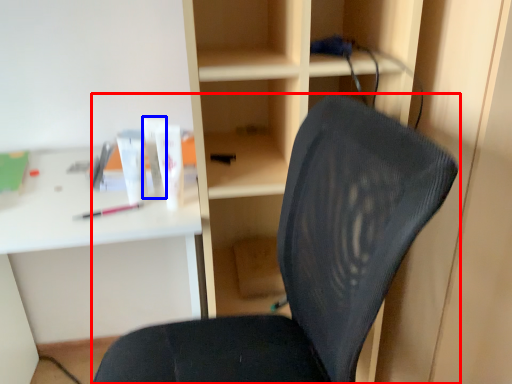
Question: Among these objects, which one is farthest to the camera, chair (highlighted by a red box) or toiletry (highlighted by a blue box)?

Choices:
 (A) chair
 (B) toiletry

Answer: (B)